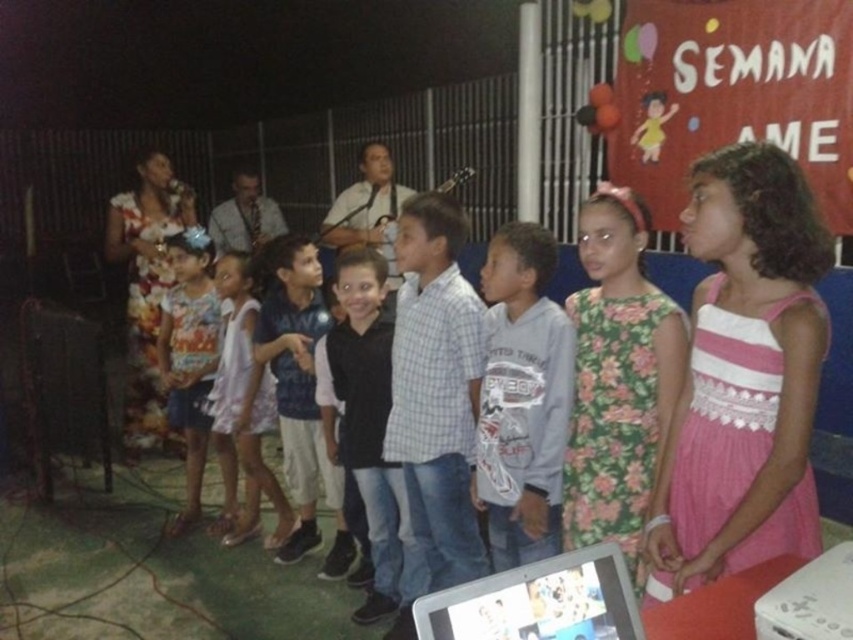
Does floral dress at center have a lesser width compared to printed cotton dress at center?

Yes, floral dress at center is thinner than printed cotton dress at center.

Does point (599, 212) lie behind point (169, 250)?

No, (599, 212) is closer to viewer.

Locate an element on the screen. Image resolution: width=853 pixels, height=640 pixels. floral dress at center is located at coordinates (618, 378).

Between silver plastic tablet at center and printed cotton dress at center, which one appears on the right side from the viewer's perspective?

From the viewer's perspective, silver plastic tablet at center appears more on the right side.

Locate an element on the screen. This screenshot has height=640, width=853. silver plastic tablet at center is located at coordinates (538, 602).

At what (x,y) coordinates should I click in order to perform the action: click on silver plastic tablet at center. Please return your answer as a coordinate pair (x, y). This screenshot has height=640, width=853. Looking at the image, I should click on (538, 602).

Which is more to the left, dark blue jersey at center or light pink fabric dress at center?

From the viewer's perspective, light pink fabric dress at center appears more on the left side.

Is dark blue jersey at center closer to camera compared to light pink fabric dress at center?

Yes, dark blue jersey at center is in front of light pink fabric dress at center.

The width and height of the screenshot is (853, 640). In order to click on dark blue jersey at center in this screenshot , I will do `click(299, 392)`.

At what (x,y) coordinates should I click in order to perform the action: click on dark blue jersey at center. Please return your answer as a coordinate pair (x, y). The height and width of the screenshot is (640, 853). Looking at the image, I should click on (299, 392).